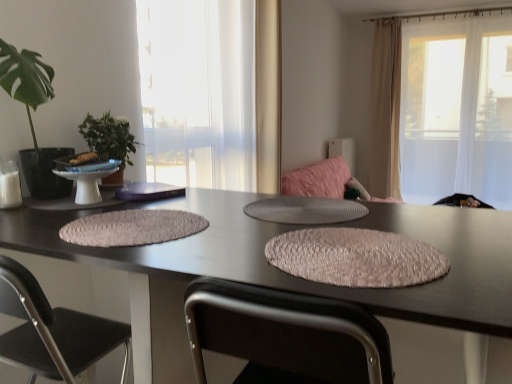
Image resolution: width=512 pixels, height=384 pixels. Identify the location of empty space that is ontop of beige fabric curtain at upper right (from a real-world perspective). (386, 19).